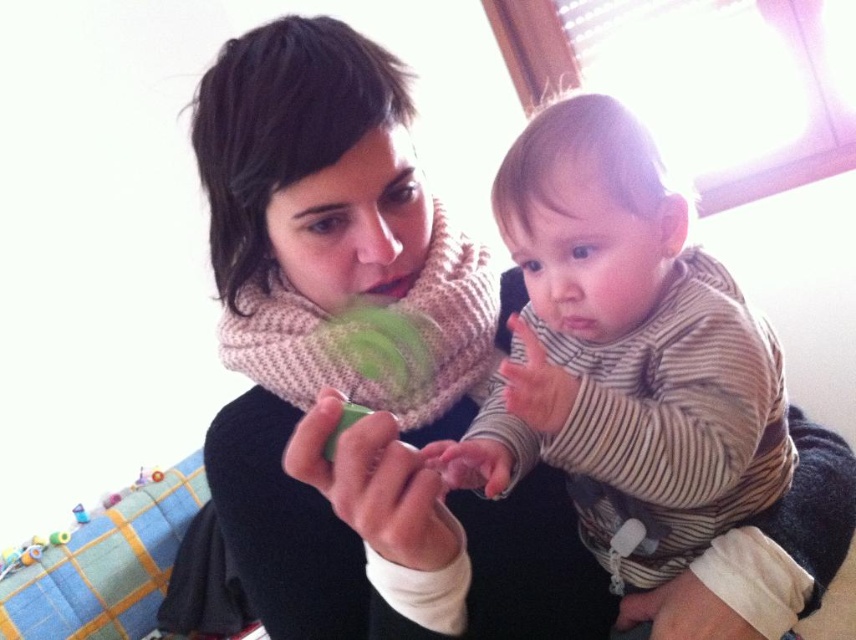
Question: Observing the image, what is the correct spatial positioning of striped cotton shirt at center in reference to white soft fabric at lower center?

Choices:
 (A) above
 (B) below

Answer: (A)

Question: Considering the relative positions of green matte toy at center and matte green toy at center in the image provided, where is green matte toy at center located with respect to matte green toy at center?

Choices:
 (A) above
 (B) below

Answer: (B)

Question: Which object is farther from the camera taking this photo?

Choices:
 (A) striped cotton shirt at center
 (B) white soft fabric at lower center
 (C) green matte toy at center
 (D) matte green toy at center

Answer: (B)

Question: Estimate the real-world distances between objects in this image. Which object is farther from the matte green toy at center?

Choices:
 (A) white soft fabric at lower center
 (B) striped cotton shirt at center

Answer: (A)

Question: Is green matte toy at center thinner than white soft fabric at lower center?

Choices:
 (A) no
 (B) yes

Answer: (A)

Question: Which of these objects is positioned farthest from the white soft fabric at lower center?

Choices:
 (A) matte green toy at center
 (B) green matte toy at center

Answer: (B)